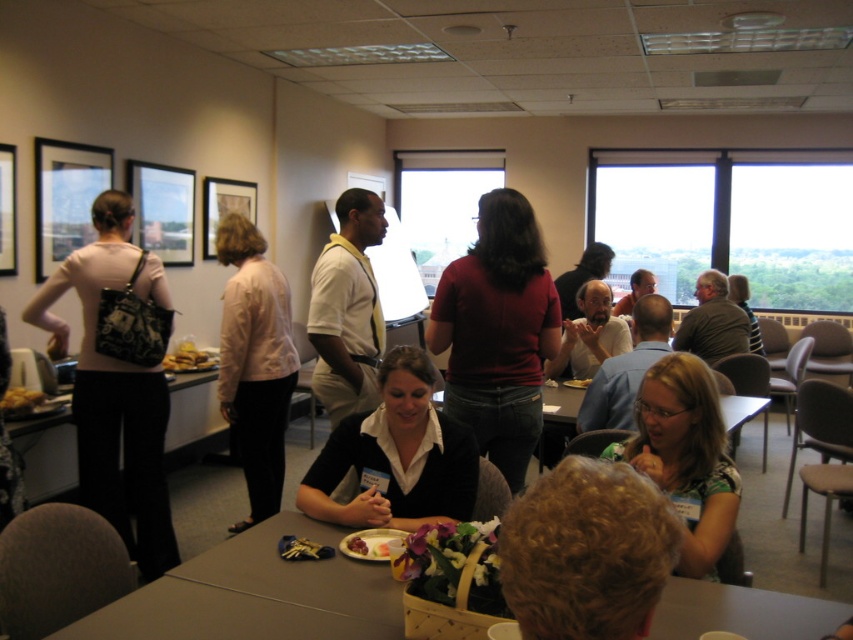
You are organizing a small event and need to place a new decorative item between the matte black purse at left and the light pink fabric shirt at center. Considering their heights, which object should be placed closer to the floor?

The light pink fabric shirt at center is shorter than the matte black purse at left, so it should be placed closer to the floor to maintain a balanced arrangement.